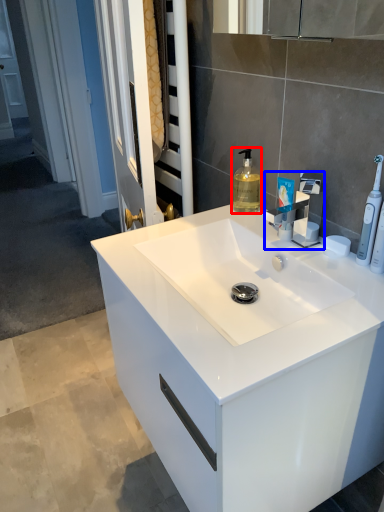
Question: Which point is closer to the camera, soap dispenser (highlighted by a red box) or tap (highlighted by a blue box)?

Choices:
 (A) soap dispenser
 (B) tap

Answer: (B)